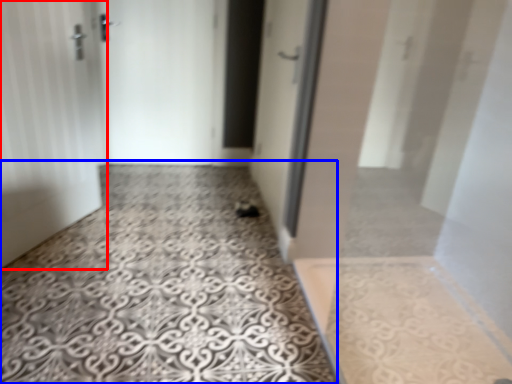
Question: Among these objects, which one is nearest to the camera, door (highlighted by a red box) or concrete (highlighted by a blue box)?

Choices:
 (A) door
 (B) concrete

Answer: (B)